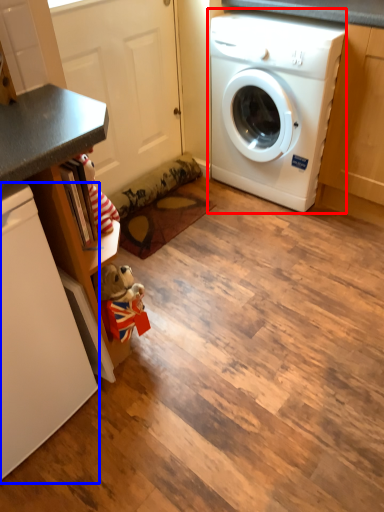
Question: Among these objects, which one is farthest to the camera, washing machine (highlighted by a red box) or dish washer (highlighted by a blue box)?

Choices:
 (A) washing machine
 (B) dish washer

Answer: (A)